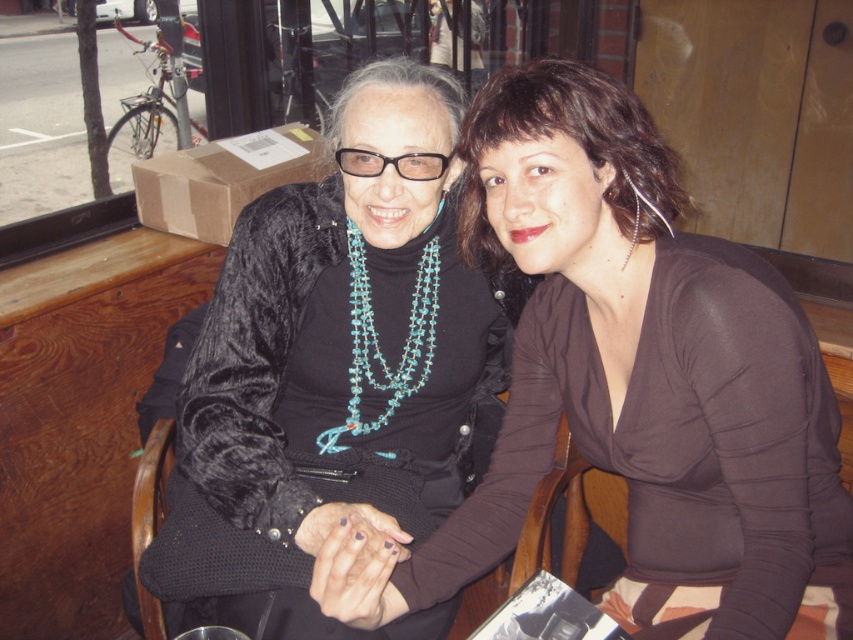
Question: Does brown matte sweater at center have a lesser width compared to velvet black sweater at center?

Choices:
 (A) no
 (B) yes

Answer: (B)

Question: Is velvet black sweater at center to the left of turquoise beaded necklace at center from the viewer's perspective?

Choices:
 (A) yes
 (B) no

Answer: (A)

Question: Among these points, which one is nearest to the camera?

Choices:
 (A) (657, 524)
 (B) (409, 314)
 (C) (350, 282)

Answer: (A)

Question: Which object is positioned farthest from the turquoise beaded necklace at center?

Choices:
 (A) velvet black sweater at center
 (B) brown matte sweater at center

Answer: (B)

Question: Which object is closer to the camera taking this photo?

Choices:
 (A) velvet black sweater at center
 (B) brown matte sweater at center

Answer: (B)

Question: Does brown matte sweater at center have a smaller size compared to turquoise beaded necklace at center?

Choices:
 (A) yes
 (B) no

Answer: (B)